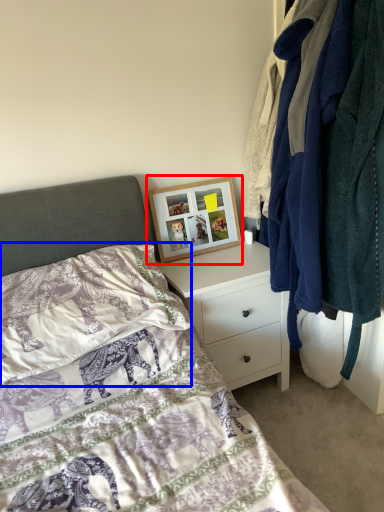
Question: Among these objects, which one is nearest to the camera, picture frame (highlighted by a red box) or pillow (highlighted by a blue box)?

Choices:
 (A) picture frame
 (B) pillow

Answer: (B)